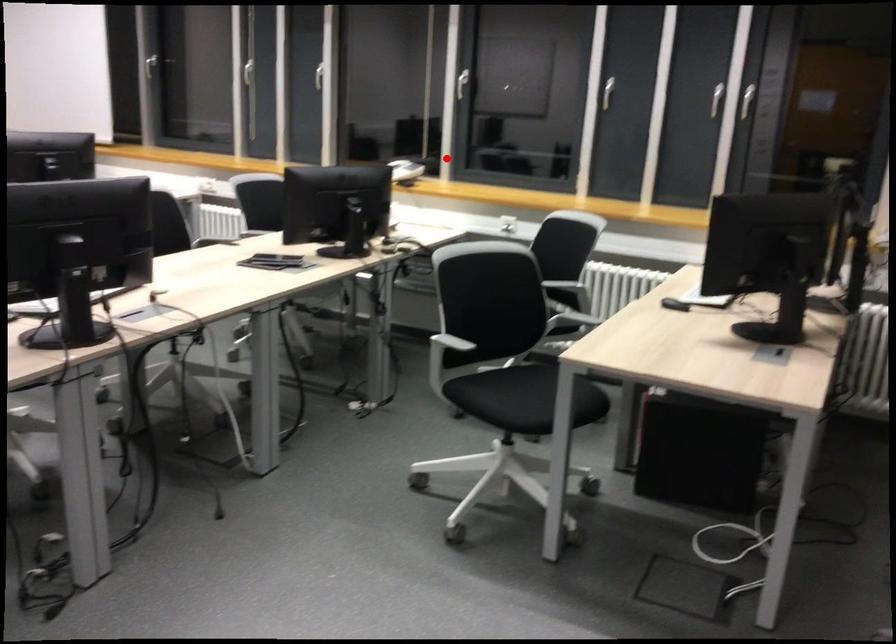
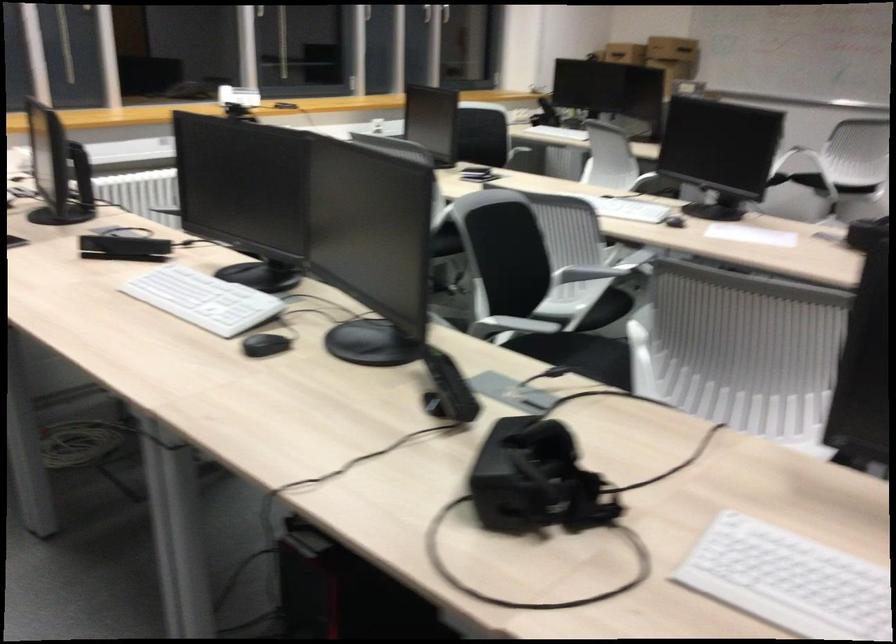
Locate, in the second image, the point that corresponds to the highlighted location in the first image.

(238, 96)